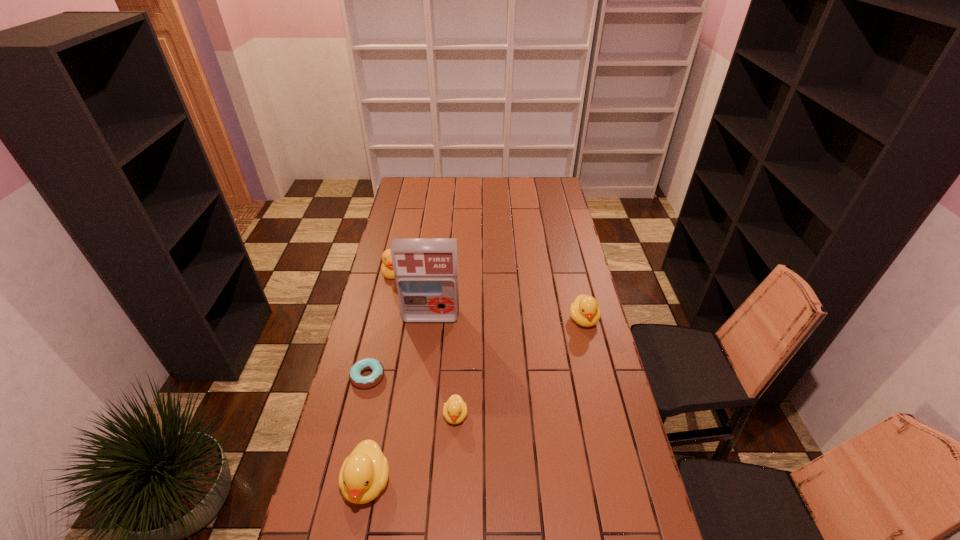
If the aim is uniform spacing by inserting an additional duckling among them, please point to a vacant space for this new duckling. Please provide its 2D coordinates. Your answer should be formatted as a tuple, i.e. [(x, y)], where the tuple contains the x and y coordinates of a point satisfying the conditions above.

[(526, 362)]